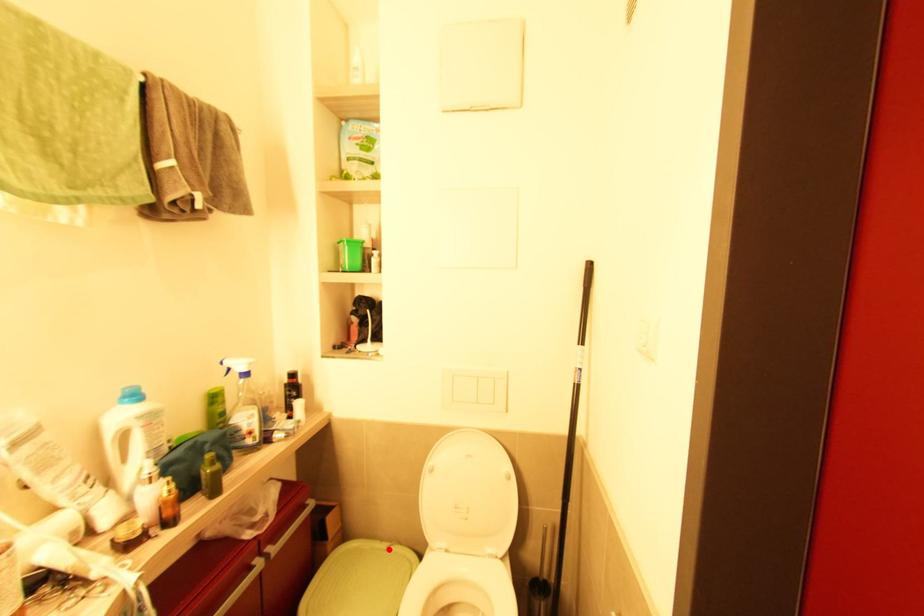
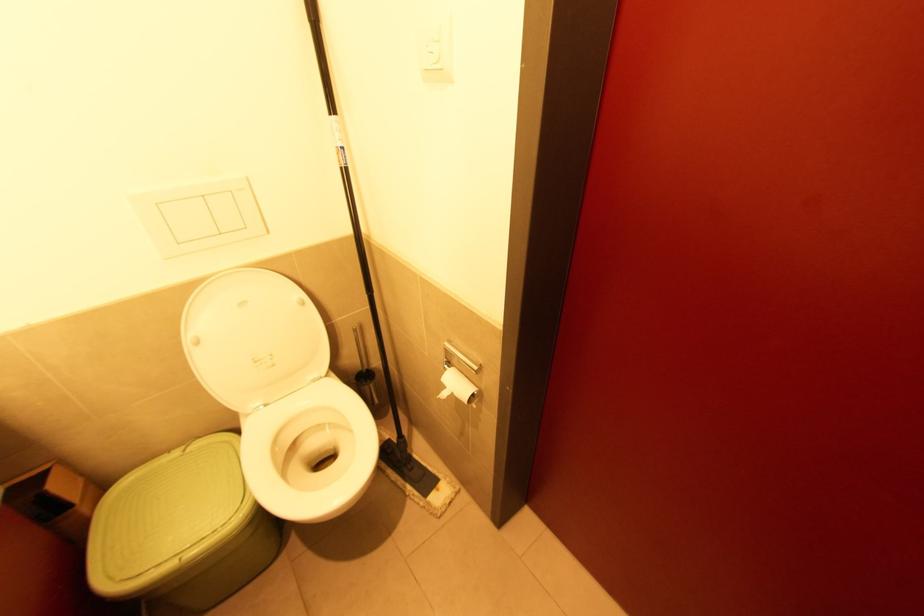
Find the pixel in the second image that matches the highlighted location in the first image.

(187, 452)